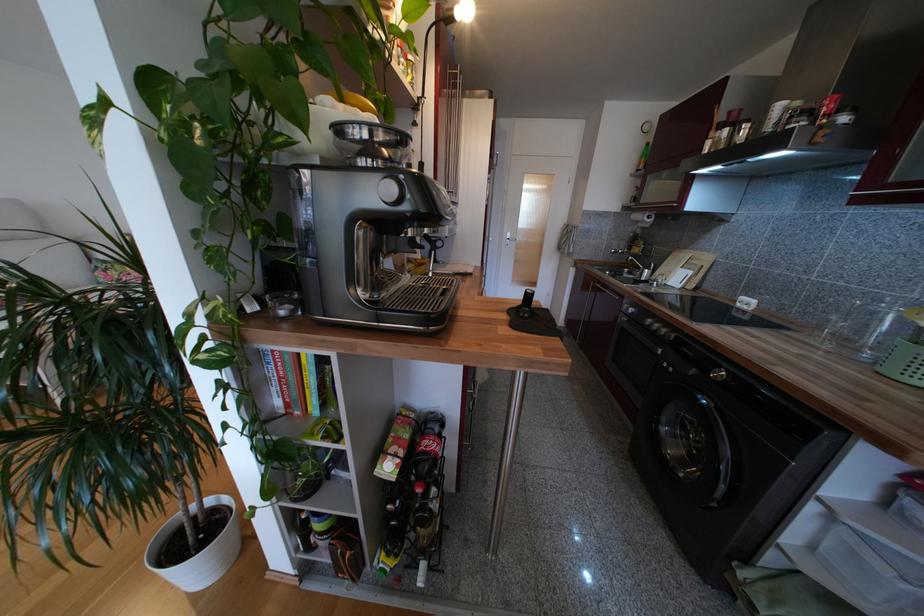
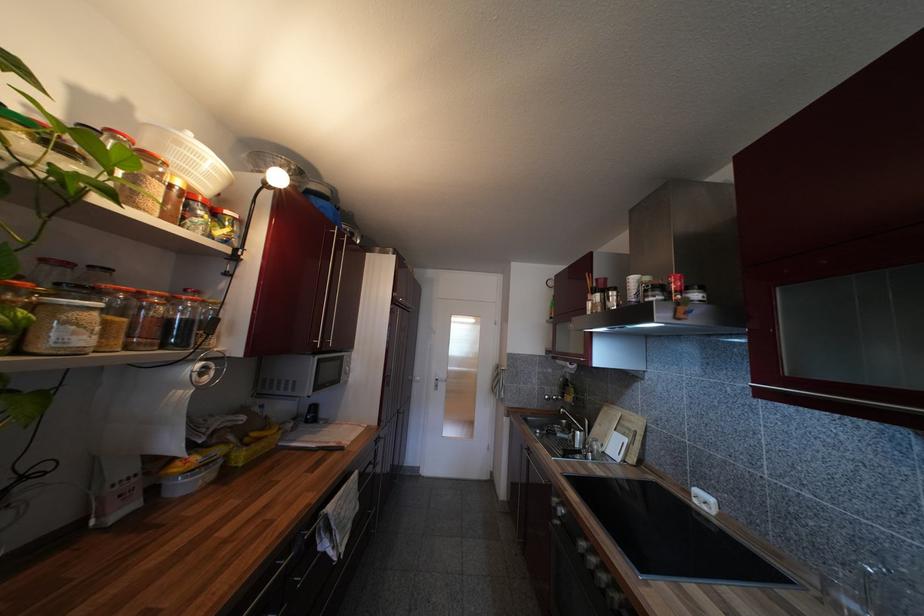
In the second image, find the point that corresponds to pixel 640 252 in the first image.

(573, 400)